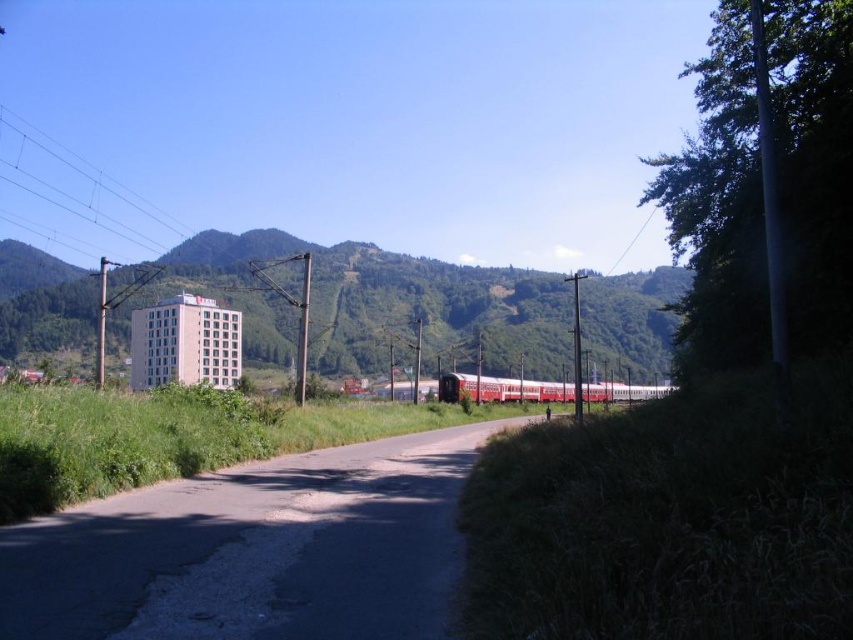
Question: Can you confirm if green grassy hill at center is positioned to the left of red polished metal train at center?

Choices:
 (A) yes
 (B) no

Answer: (A)

Question: Is green grassy hill at center above red polished metal train at center?

Choices:
 (A) yes
 (B) no

Answer: (A)

Question: Considering the real-world distances, which object is closest to the metallic wire at upper left?

Choices:
 (A) green grassy hill at center
 (B) red polished metal train at center

Answer: (A)

Question: Can you confirm if metallic wire at upper left is positioned below red polished metal train at center?

Choices:
 (A) no
 (B) yes

Answer: (A)

Question: Which object is the farthest from the green grassy hill at center?

Choices:
 (A) metallic wire at upper left
 (B) red polished metal train at center

Answer: (A)

Question: Based on their relative distances, which object is nearer to the metallic wire at upper left?

Choices:
 (A) green grassy hill at center
 (B) red polished metal train at center

Answer: (A)